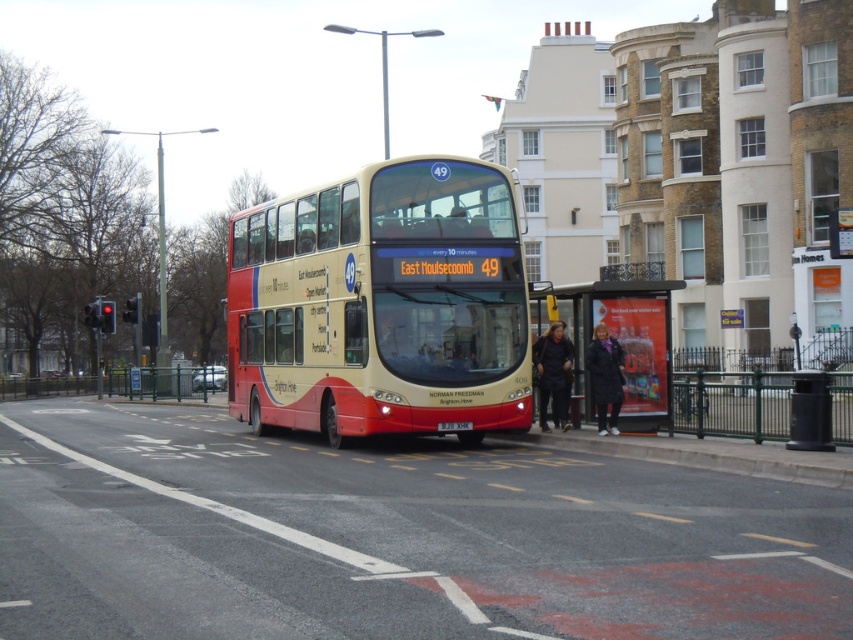
You are a delivery person carrying a large package that is 1.5 meters in length. You need to place it on the matte plastic bus stop at center. Can you fit the package on the bus stop without it overhanging?

The matte plastic bus stop at center is 16.27 meters away from camera. However, the distance does not indicate the size of the bus stop. Therefore, it is impossible to determine if the 1.5 meters long package can fit on the bus stop without overhanging based on the given information.

You are a drone operator trying to capture a photo of the bus stop scene. You need to ensure that both the point at coordinates point(619, 340) and point(450, 432) are in focus. Based on their depth positions, which point should you focus on to ensure both are sharp?

To ensure both points are in focus, focus on point(450, 432) since it is closer to the camera, allowing the point(619, 340) to be within the depth of field range.

You are a delivery person who needs to place a rectangular package on the matte plastic bus stop at center. The package is as wide as the black plastic license plate at center. Will the package fit on the bus stop?

The matte plastic bus stop at center has a lesser width compared to black plastic license plate at center. Since the package is as wide as the license plate, it will not fit on the bus stop due to its narrower width.